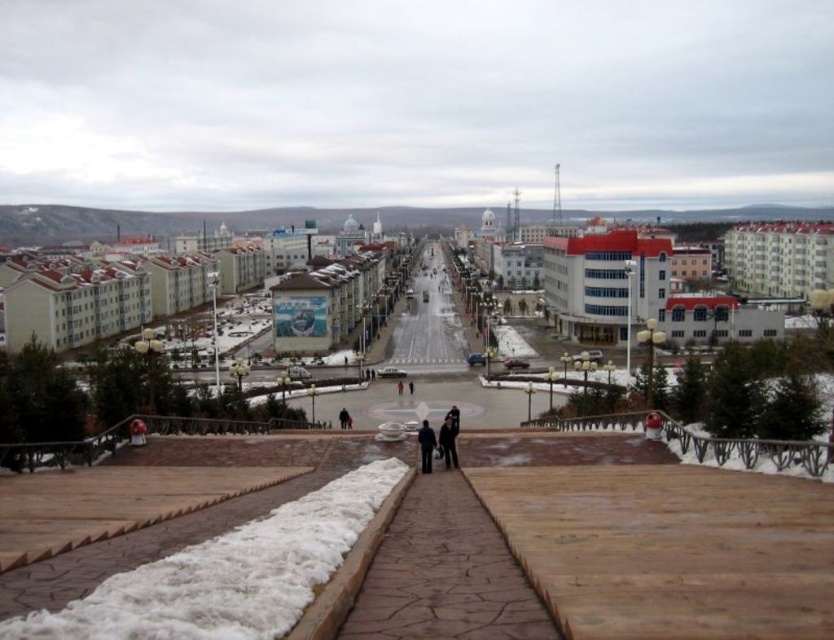
Which is more to the left, black leather jacket at center or dark blue jacket at center?

From the viewer's perspective, dark blue jacket at center appears more on the left side.

Is the position of black leather jacket at center less distant than that of dark blue jacket at center?

No.

You are a GUI agent. You are given a task and a screenshot of the screen. Output one action in this format:
    pyautogui.click(x=<x>, y=<y>)
    Task: Click on the black leather jacket at center
    The width and height of the screenshot is (834, 640).
    Given the screenshot: What is the action you would take?
    pyautogui.click(x=448, y=440)

Identify the location of black leather jacket at center. (448, 440).

Which of these two, white fluffy snow at center or dark blue jacket at center, stands shorter?

white fluffy snow at center

I want to click on white fluffy snow at center, so click(227, 573).

From the picture: Can you confirm if white fluffy snow at center is positioned to the left of dark blue jeans at center?

Yes, white fluffy snow at center is to the left of dark blue jeans at center.

Is point (209, 586) less distant than point (433, 442)?

That is True.

Does point (194, 632) come behind point (425, 451)?

No.

At what (x,y) coordinates should I click in order to perform the action: click on white fluffy snow at center. Please return your answer as a coordinate pair (x, y). The image size is (834, 640). Looking at the image, I should click on (227, 573).